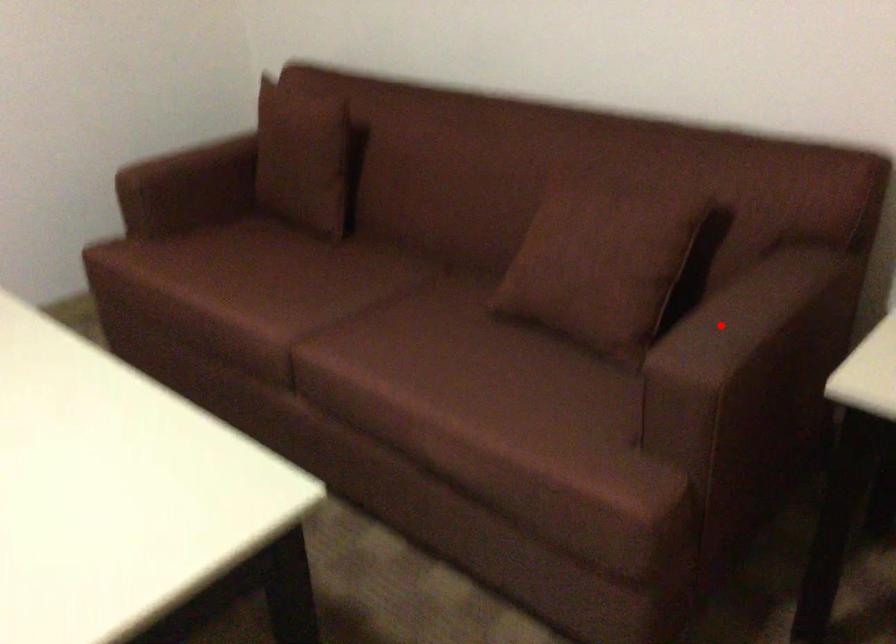
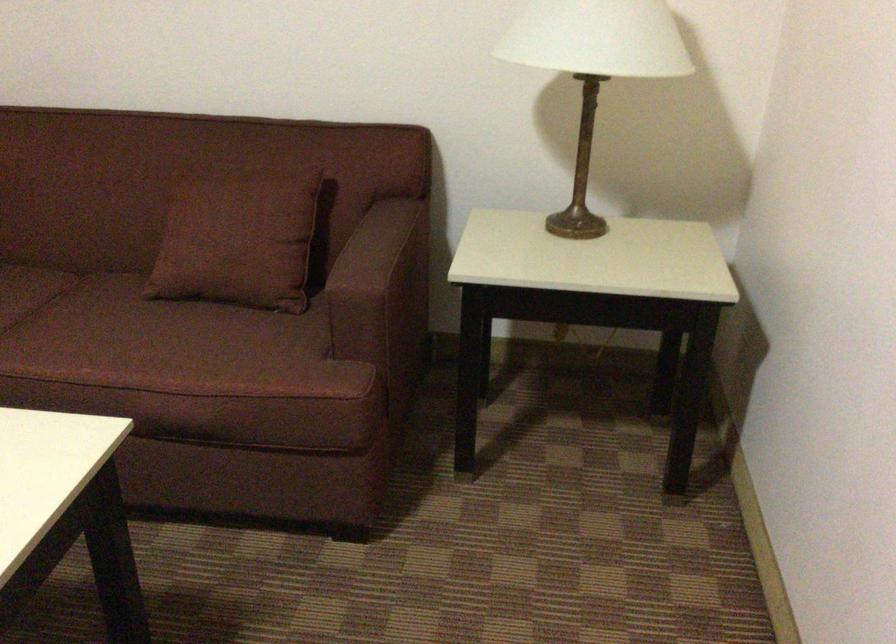
Question: I am providing you with two images of the same scene from different viewpoints. A red point is marked on the first image. At the location where the point appears in image 1, is it still visible in image 2?

Choices:
 (A) Yes
 (B) No

Answer: (A)